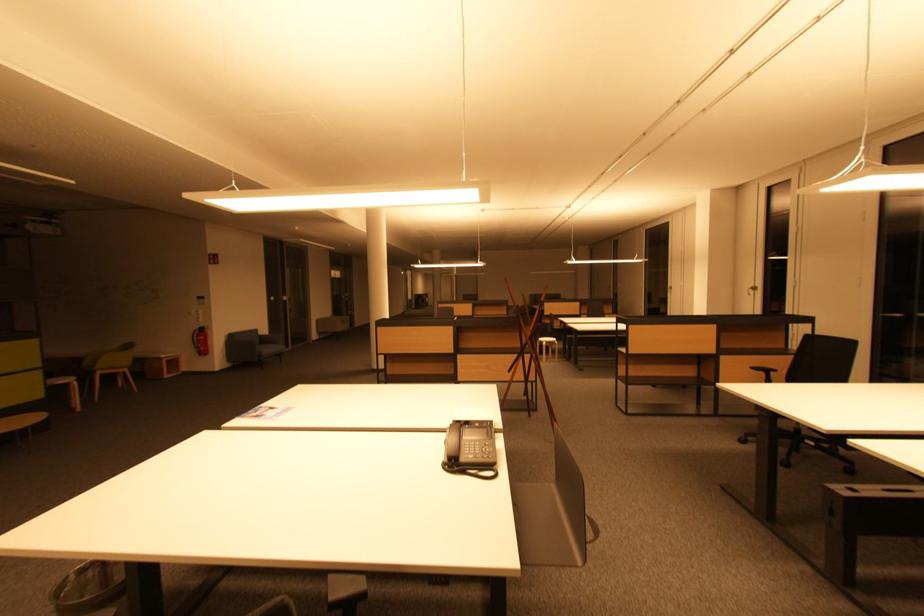
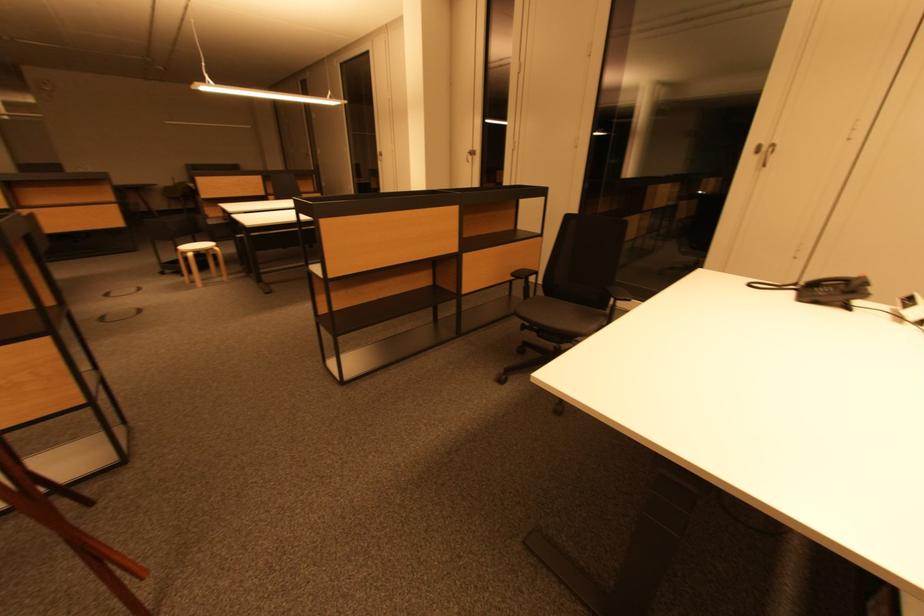
Question: I am providing you with two images of the same scene from different viewpoints. Which of the following objects are not visible in image2?

Choices:
 (A) white cabinet handle
 (B) floor outlet cover
 (C) black chair sitting surface
 (D) none of these

Answer: (D)